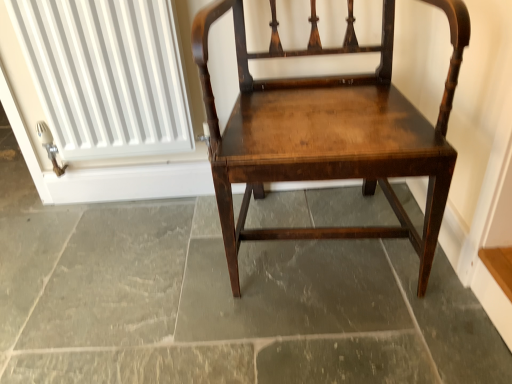
Locate an element on the screen. This screenshot has width=512, height=384. free space to the left of shiny dark wood chair at center is located at coordinates (152, 276).